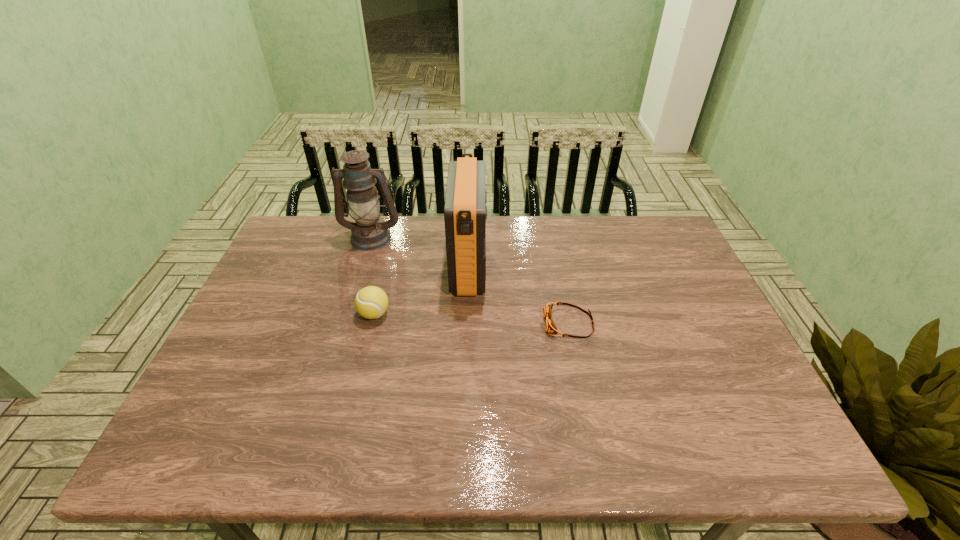
Identify the location of vacant space in between the third tallest object and the second object from right to left. (421, 291).

You are a GUI agent. You are given a task and a screenshot of the screen. Output one action in this format:
    pyautogui.click(x=<x>, y=<y>)
    Task: Click on the vacant area between the oil lamp and the third tallest object
    The height and width of the screenshot is (540, 960).
    Given the screenshot: What is the action you would take?
    pyautogui.click(x=372, y=275)

This screenshot has width=960, height=540. Identify the location of free space between the oil lamp and the second shortest object. (372, 275).

At what (x,y) coordinates should I click in order to perform the action: click on vacant area that lies between the third object from left to right and the oil lamp. Please return your answer as a coordinate pair (x, y). Looking at the image, I should click on (420, 252).

Where is `empty location between the oil lamp and the tennis ball`? The image size is (960, 540). empty location between the oil lamp and the tennis ball is located at coordinates (372, 275).

The image size is (960, 540). Find the location of `free space between the tennis ball and the goggles`. free space between the tennis ball and the goggles is located at coordinates (471, 319).

Identify which object is the nearest to the third tallest object. Please provide its 2D coordinates. Your answer should be formatted as a tuple, i.e. [(x, y)], where the tuple contains the x and y coordinates of a point satisfying the conditions above.

[(465, 211)]

Locate which object is the third closest to the oil lamp. Please provide its 2D coordinates. Your answer should be formatted as a tuple, i.e. [(x, y)], where the tuple contains the x and y coordinates of a point satisfying the conditions above.

[(550, 327)]

Where is `free point that satisfies the following two spatial constraints: 1. on the front-facing side of the third object from left to right; 2. on the front side of the tennis ball`? This screenshot has height=540, width=960. free point that satisfies the following two spatial constraints: 1. on the front-facing side of the third object from left to right; 2. on the front side of the tennis ball is located at coordinates (468, 314).

Locate an element on the screen. The image size is (960, 540). blank space that satisfies the following two spatial constraints: 1. on the front side of the oil lamp; 2. on the left side of the tennis ball is located at coordinates (348, 314).